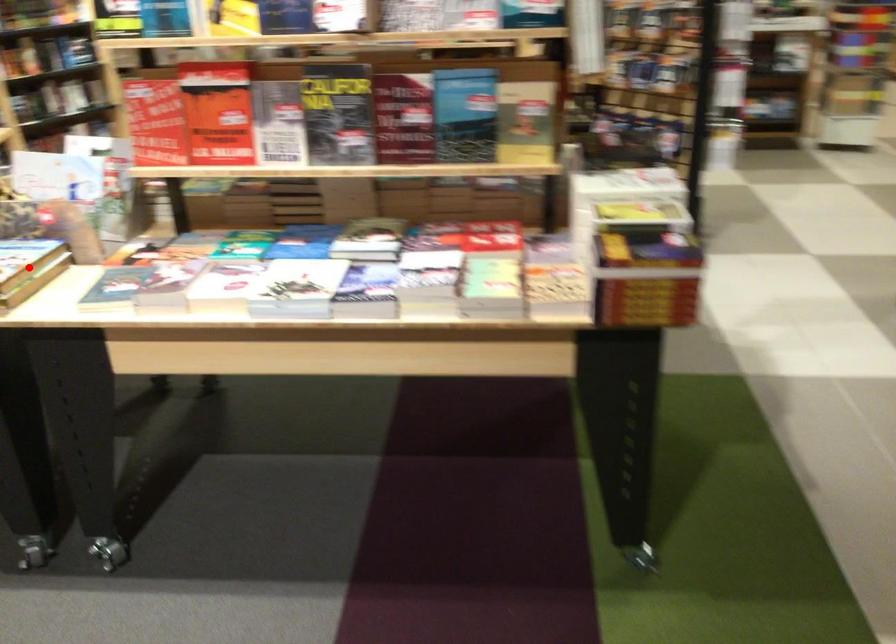
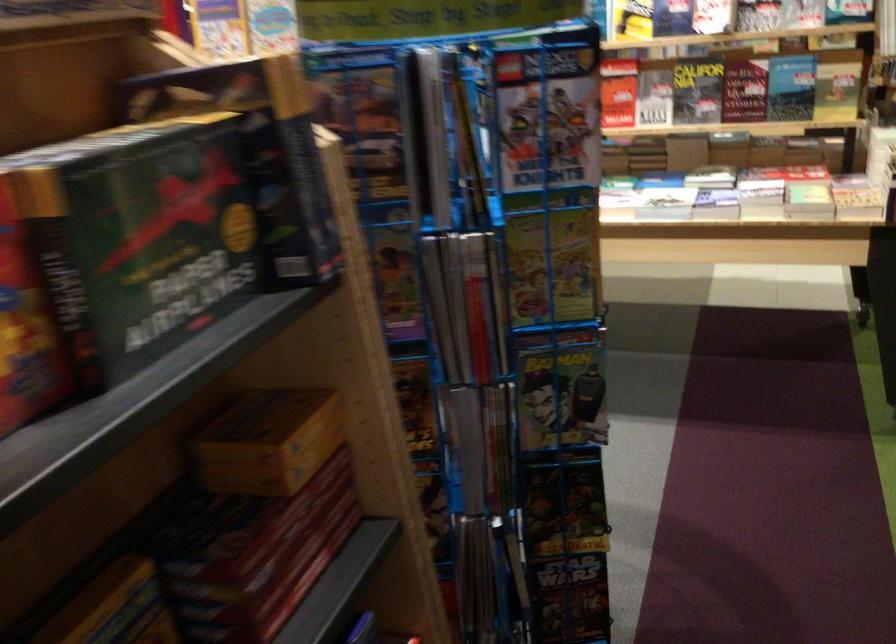
Question: I am providing you with two images of the same scene from different viewpoints. A red point is marked on the first image. At the location where the point appears in image 1, is it still visible in image 2?

Choices:
 (A) Yes
 (B) No

Answer: (B)